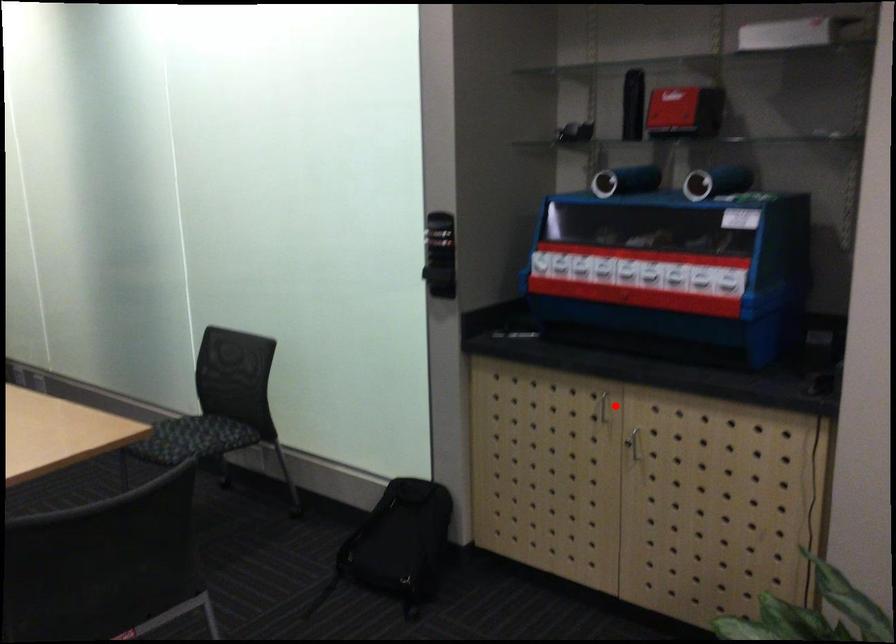
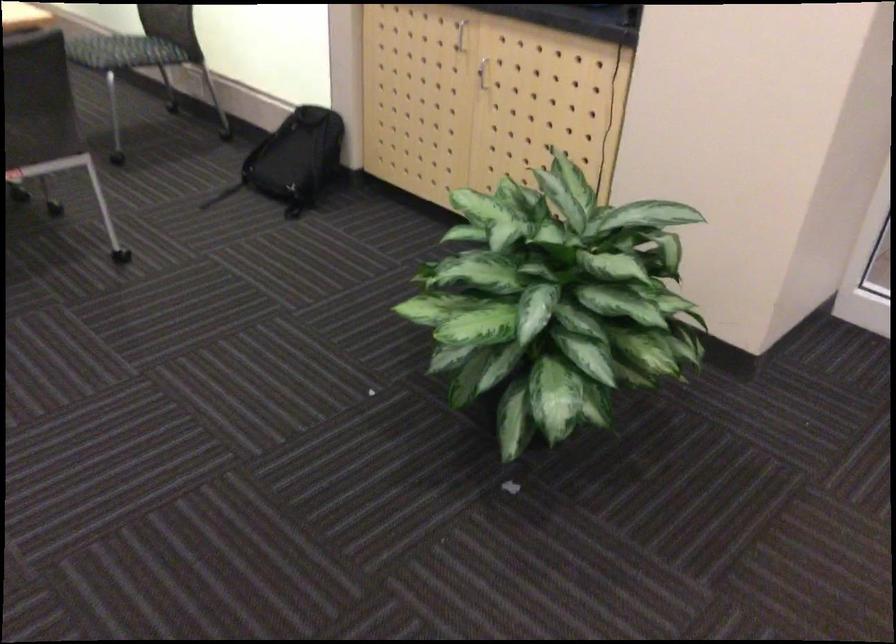
Question: I am providing you with two images of the same scene from different viewpoints. Image1 has a red point marked. In image2, the corresponding 3D location appears at what relative position? Reply with the corresponding letter.

Choices:
 (A) Closer
 (B) Farther

Answer: (B)